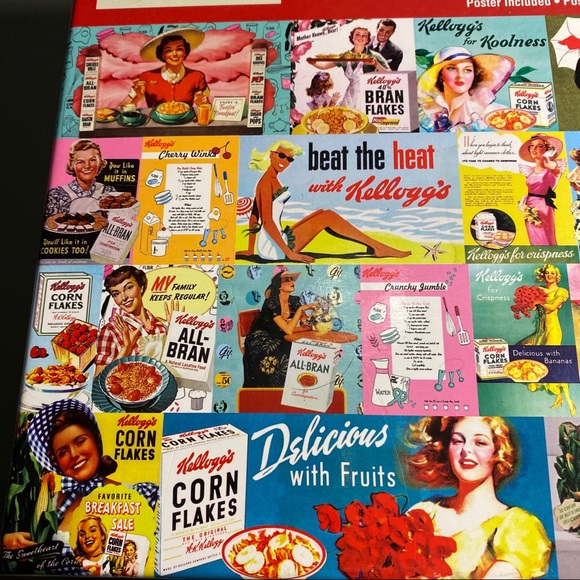
You are a GUI agent. You are given a task and a screenshot of the screen. Output one action in this format:
    pyautogui.click(x=<x>, y=<y>)
    Task: Click on the bowl of cereal
    
    Given the screenshot: What is the action you would take?
    pyautogui.click(x=273, y=548), pyautogui.click(x=134, y=373), pyautogui.click(x=517, y=123), pyautogui.click(x=175, y=104)